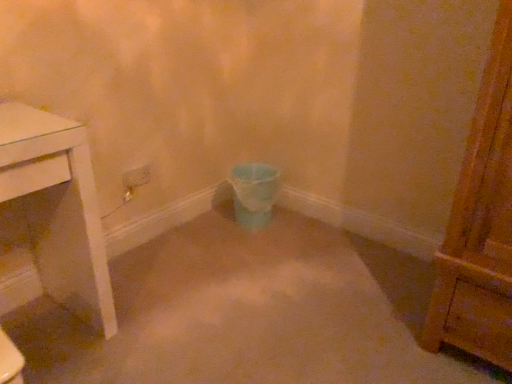
What do you see at coordinates (137, 177) in the screenshot?
I see `white plastic power plugs and sockets at center` at bounding box center [137, 177].

In order to face white plastic power plugs and sockets at center, should I rotate leftwards or rightwards?

Rotate left and turn 15.582 degrees.

Find the location of a particular element. white plastic power plugs and sockets at center is located at coordinates (137, 177).

This screenshot has height=384, width=512. I want to click on matte blue plastic toilet bowl at center, so pos(254,193).

The image size is (512, 384). What do you see at coordinates (254, 193) in the screenshot? I see `matte blue plastic toilet bowl at center` at bounding box center [254, 193].

You are a GUI agent. You are given a task and a screenshot of the screen. Output one action in this format:
    pyautogui.click(x=<x>, y=<y>)
    Task: Click on the white plastic power plugs and sockets at center
    
    Given the screenshot: What is the action you would take?
    pyautogui.click(x=137, y=177)

Visually, is matte blue plastic toilet bowl at center positioned to the left or to the right of white plastic power plugs and sockets at center?

matte blue plastic toilet bowl at center is positioned on white plastic power plugs and sockets at center's right side.

Based on the photo, which object is closer to the camera, matte blue plastic toilet bowl at center or white plastic power plugs and sockets at center?

Positioned in front is white plastic power plugs and sockets at center.

Is point (259, 215) positioned after point (134, 177)?

That is True.

From the image's perspective, is matte blue plastic toilet bowl at center located above or below white plastic power plugs and sockets at center?

matte blue plastic toilet bowl at center is situated lower than white plastic power plugs and sockets at center in the image.

From a real-world perspective, is matte blue plastic toilet bowl at center physically above white plastic power plugs and sockets at center?

Actually, matte blue plastic toilet bowl at center is physically below white plastic power plugs and sockets at center in the real world.

Considering the sizes of objects matte blue plastic toilet bowl at center and white plastic power plugs and sockets at center in the image provided, who is thinner, matte blue plastic toilet bowl at center or white plastic power plugs and sockets at center?

white plastic power plugs and sockets at center.

Who is shorter, matte blue plastic toilet bowl at center or white plastic power plugs and sockets at center?

Standing shorter between the two is white plastic power plugs and sockets at center.

Does matte blue plastic toilet bowl at center have a larger size compared to white plastic power plugs and sockets at center?

Indeed, matte blue plastic toilet bowl at center has a larger size compared to white plastic power plugs and sockets at center.

Is matte blue plastic toilet bowl at center outside of white plastic power plugs and sockets at center?

Absolutely, matte blue plastic toilet bowl at center is external to white plastic power plugs and sockets at center.

Would you say matte blue plastic toilet bowl at center is a long distance from white plastic power plugs and sockets at center?

No, matte blue plastic toilet bowl at center is not far away from white plastic power plugs and sockets at center.

Is white plastic power plugs and sockets at center at the back of matte blue plastic toilet bowl at center?

No.

The width and height of the screenshot is (512, 384). Find the location of `power plugs and sockets above the matte blue plastic toilet bowl at center (from the image's perspective)`. power plugs and sockets above the matte blue plastic toilet bowl at center (from the image's perspective) is located at coordinates (137, 177).

Looking at this image, can you confirm if white plastic power plugs and sockets at center is positioned to the left of matte blue plastic toilet bowl at center?

Indeed, white plastic power plugs and sockets at center is positioned on the left side of matte blue plastic toilet bowl at center.

Is white plastic power plugs and sockets at center positioned in front of matte blue plastic toilet bowl at center?

Yes.

Which is in front, point (145, 183) or point (253, 224)?

The point (145, 183) is in front.

From the image's perspective, is white plastic power plugs and sockets at center on top of matte blue plastic toilet bowl at center?

Yes.

From a real-world perspective, between white plastic power plugs and sockets at center and matte blue plastic toilet bowl at center, who is vertically higher?

white plastic power plugs and sockets at center.

Does white plastic power plugs and sockets at center have a greater width compared to matte blue plastic toilet bowl at center?

No.

In the scene shown: Can you confirm if white plastic power plugs and sockets at center is shorter than matte blue plastic toilet bowl at center?

Yes.

Considering the sizes of white plastic power plugs and sockets at center and matte blue plastic toilet bowl at center in the image, is white plastic power plugs and sockets at center bigger or smaller than matte blue plastic toilet bowl at center?

Considering their sizes, white plastic power plugs and sockets at center takes up less space than matte blue plastic toilet bowl at center.

Is white plastic power plugs and sockets at center not within matte blue plastic toilet bowl at center?

white plastic power plugs and sockets at center lies outside matte blue plastic toilet bowl at center's area.

Can you see white plastic power plugs and sockets at center touching matte blue plastic toilet bowl at center?

No.

Could you tell me if white plastic power plugs and sockets at center is facing matte blue plastic toilet bowl at center?

No, white plastic power plugs and sockets at center is not aimed at matte blue plastic toilet bowl at center.

The width and height of the screenshot is (512, 384). In order to click on power plugs and sockets above the matte blue plastic toilet bowl at center (from the image's perspective) in this screenshot , I will do `click(137, 177)`.

At what (x,y) coordinates should I click in order to perform the action: click on toilet bowl below the white plastic power plugs and sockets at center (from the image's perspective). Please return your answer as a coordinate pair (x, y). This screenshot has height=384, width=512. Looking at the image, I should click on (254, 193).

Where is `toilet bowl that appears on the right of white plastic power plugs and sockets at center`? This screenshot has width=512, height=384. toilet bowl that appears on the right of white plastic power plugs and sockets at center is located at coordinates pyautogui.click(x=254, y=193).